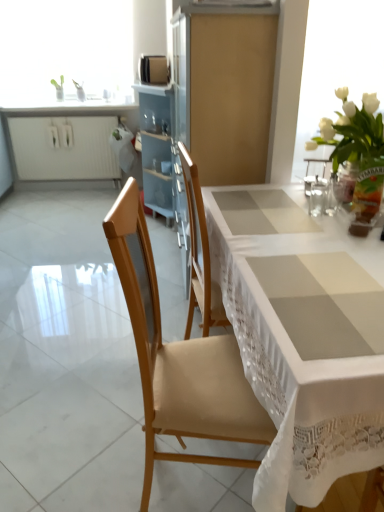
This screenshot has height=512, width=384. I want to click on vacant region to the left of green glass vase at upper right, so click(330, 209).